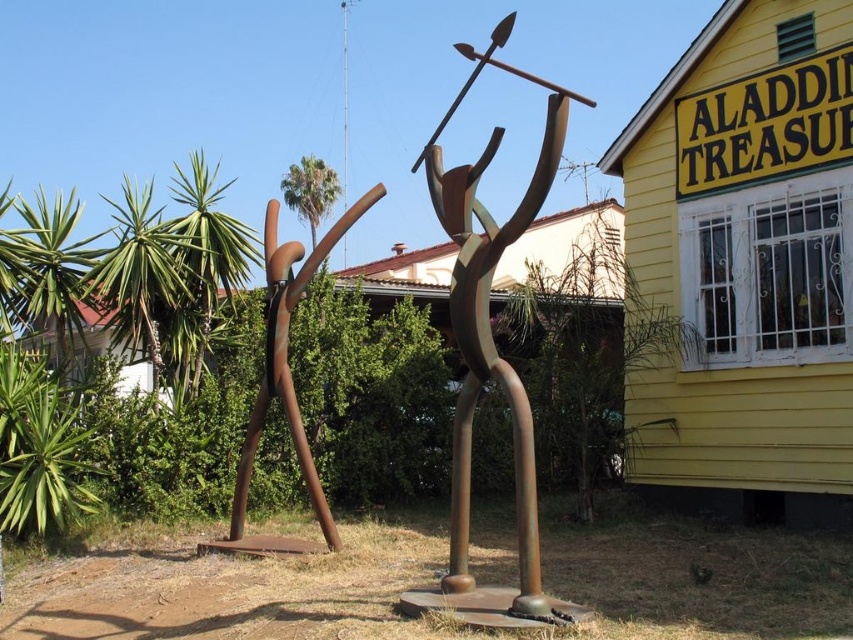
Does point (556, 600) come closer to viewer compared to point (311, 493)?

Yes.

Find the location of a particular element. This screenshot has height=640, width=853. rusty metal figure at center is located at coordinates (490, 362).

You are a GUI agent. You are given a task and a screenshot of the screen. Output one action in this format:
    pyautogui.click(x=<x>, y=<y>)
    Task: Click on the rusty metal figure at center
    Image resolution: width=853 pixels, height=640 pixels.
    Given the screenshot: What is the action you would take?
    pyautogui.click(x=490, y=362)